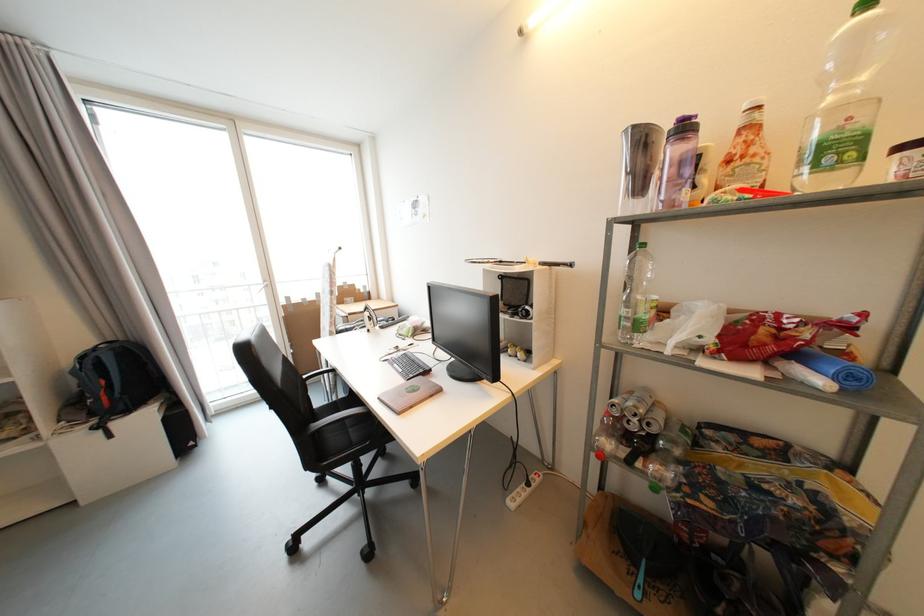
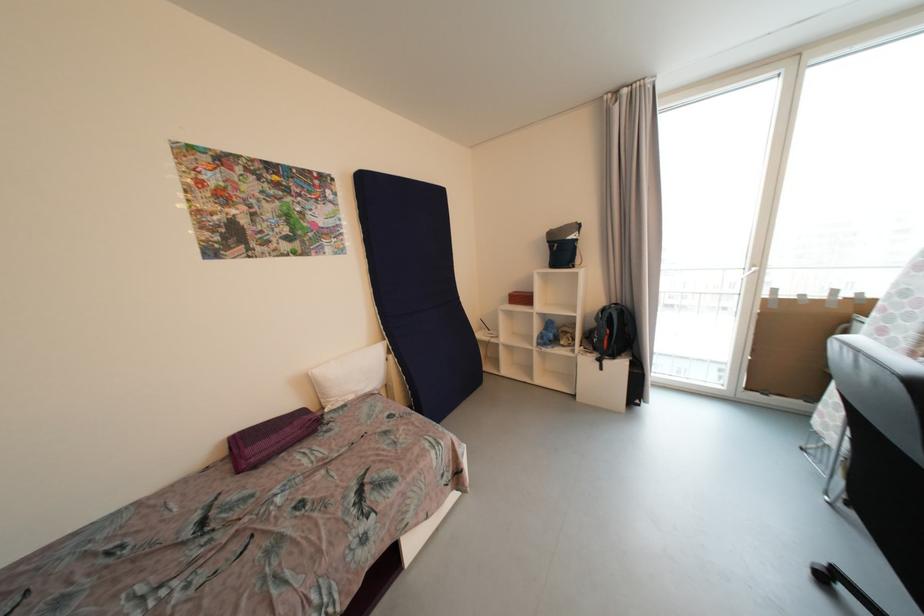
In the second image, find the point that corresponds to the point at 89,359 in the first image.

(608, 312)